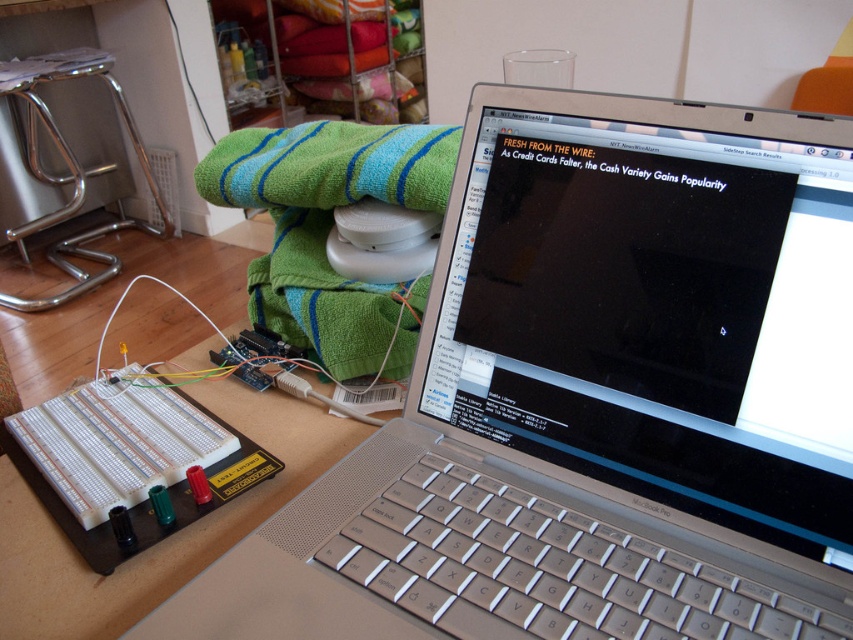
Between silver metallic laptop at center and green striped towel at upper center, which one is positioned lower?

silver metallic laptop at center is lower down.

Does silver metallic laptop at center appear over green striped towel at upper center?

No, silver metallic laptop at center is not above green striped towel at upper center.

What do you see at coordinates (595, 397) in the screenshot?
I see `silver metallic laptop at center` at bounding box center [595, 397].

This screenshot has height=640, width=853. I want to click on silver metallic laptop at center, so click(x=595, y=397).

What are the coordinates of `green striped towel at upper center` in the screenshot? It's located at (329, 228).

Does point (283, 285) come closer to viewer compared to point (137, 596)?

That is False.

Identify the location of green striped towel at upper center. (329, 228).

Is silver metallic laptop at center positioned before white plastic breadboard at lower left?

Yes, it is in front of white plastic breadboard at lower left.

Does point (669, 225) come farther from viewer compared to point (27, 518)?

That is False.

This screenshot has width=853, height=640. I want to click on silver metallic laptop at center, so click(x=595, y=397).